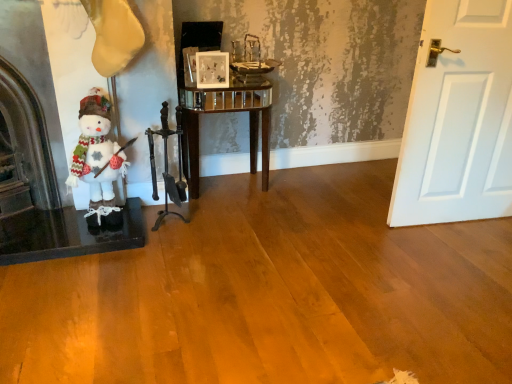
Question: Is there a large distance between dark brown stone fireplace at left and dark brown polished wood fireplace tools at center?

Choices:
 (A) yes
 (B) no

Answer: (B)

Question: Can you confirm if dark brown stone fireplace at left is wider than dark brown polished wood fireplace tools at center?

Choices:
 (A) yes
 (B) no

Answer: (A)

Question: Can you confirm if dark brown stone fireplace at left is shorter than dark brown polished wood fireplace tools at center?

Choices:
 (A) yes
 (B) no

Answer: (B)

Question: From the image's perspective, is dark brown stone fireplace at left located beneath dark brown polished wood fireplace tools at center?

Choices:
 (A) yes
 (B) no

Answer: (B)

Question: Is dark brown stone fireplace at left positioned in front of dark brown polished wood fireplace tools at center?

Choices:
 (A) yes
 (B) no

Answer: (A)

Question: Considering the relative sizes of dark brown stone fireplace at left and dark brown polished wood fireplace tools at center in the image provided, is dark brown stone fireplace at left bigger than dark brown polished wood fireplace tools at center?

Choices:
 (A) no
 (B) yes

Answer: (B)

Question: Can you confirm if dark brown polished wood fireplace tools at center is taller than white fabric snowman at left?

Choices:
 (A) no
 (B) yes

Answer: (B)

Question: Is dark brown polished wood fireplace tools at center far away from white fabric snowman at left?

Choices:
 (A) no
 (B) yes

Answer: (A)

Question: Does dark brown polished wood fireplace tools at center have a larger size compared to white fabric snowman at left?

Choices:
 (A) no
 (B) yes

Answer: (A)

Question: Is dark brown polished wood fireplace tools at center further to the viewer compared to white fabric snowman at left?

Choices:
 (A) yes
 (B) no

Answer: (A)

Question: Is dark brown polished wood fireplace tools at center aimed at white fabric snowman at left?

Choices:
 (A) yes
 (B) no

Answer: (B)

Question: Is dark brown polished wood fireplace tools at center in front of white fabric snowman at left?

Choices:
 (A) yes
 (B) no

Answer: (B)

Question: From a real-world perspective, is dark brown polished wood fireplace tools at center beneath dark brown stone fireplace at left?

Choices:
 (A) yes
 (B) no

Answer: (A)